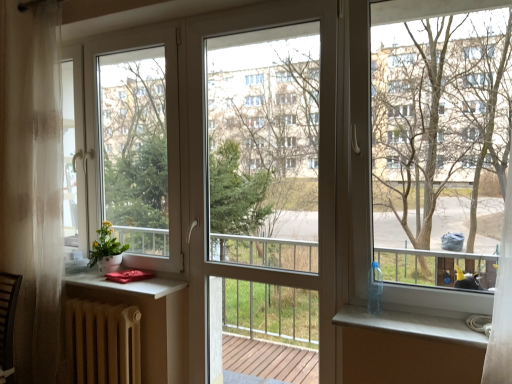
In order to click on vacant space situated above matte brown radiator at lower left (from a real-world perspective) in this screenshot , I will do (x=99, y=299).